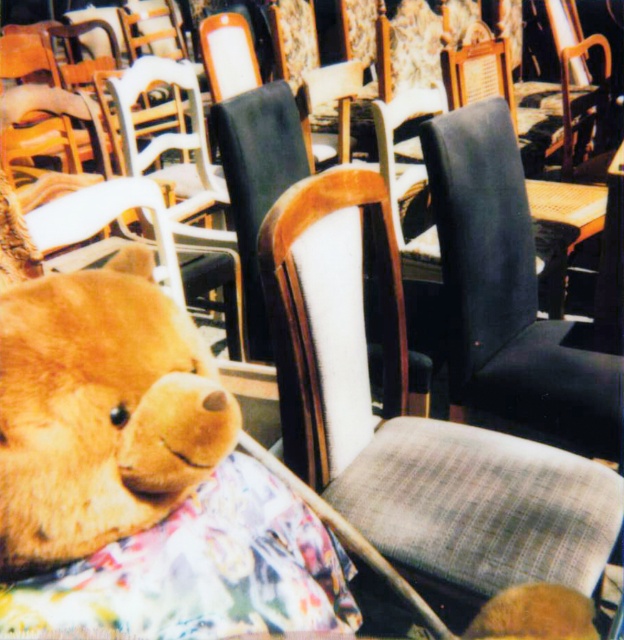
Question: Which object is closer to the camera taking this photo?

Choices:
 (A) fluffy brown teddy bear at lower left
 (B) plaid fabric chair at center

Answer: (A)

Question: Is plaid fabric chair at center further to the viewer compared to fluffy brown teddy bear at lower left?

Choices:
 (A) yes
 (B) no

Answer: (A)

Question: Is plaid fabric chair at center closer to the viewer compared to fluffy brown teddy bear at lower left?

Choices:
 (A) no
 (B) yes

Answer: (A)

Question: Does plaid fabric chair at center have a smaller size compared to fluffy brown teddy bear at lower left?

Choices:
 (A) yes
 (B) no

Answer: (B)

Question: Among these objects, which one is nearest to the camera?

Choices:
 (A) plaid fabric chair at center
 (B) fluffy brown teddy bear at lower left

Answer: (B)